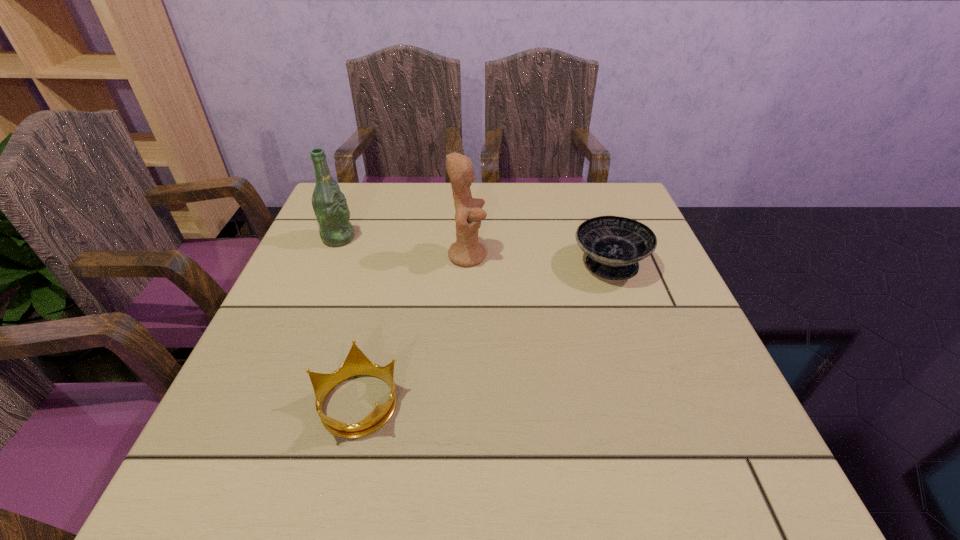
This screenshot has height=540, width=960. Identify the location of free region that satisfies the following two spatial constraints: 1. on the back side of the crown; 2. on the surface of the beer bottle. (396, 238).

Locate an element on the screen. Image resolution: width=960 pixels, height=540 pixels. free space that satisfies the following two spatial constraints: 1. on the front-facing side of the figurine; 2. on the right side of the rightmost object is located at coordinates (468, 265).

Locate an element on the screen. The image size is (960, 540). vacant position in the image that satisfies the following two spatial constraints: 1. on the surface of the beer bottle; 2. on the right side of the bowl is located at coordinates (327, 265).

The width and height of the screenshot is (960, 540). I want to click on free location that satisfies the following two spatial constraints: 1. on the back side of the rightmost object; 2. on the front-facing side of the figurine, so click(x=606, y=255).